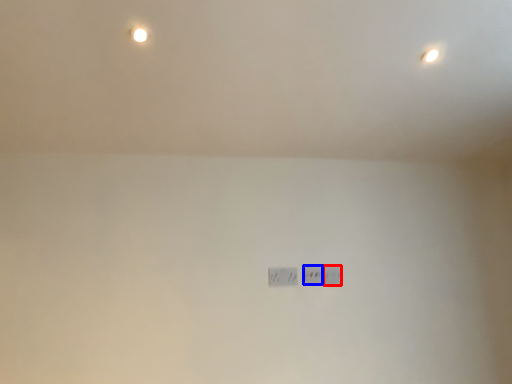
Question: Which object is further to the camera taking this photo, power plugs and sockets (highlighted by a red box) or power plugs and sockets (highlighted by a blue box)?

Choices:
 (A) power plugs and sockets
 (B) power plugs and sockets

Answer: (A)